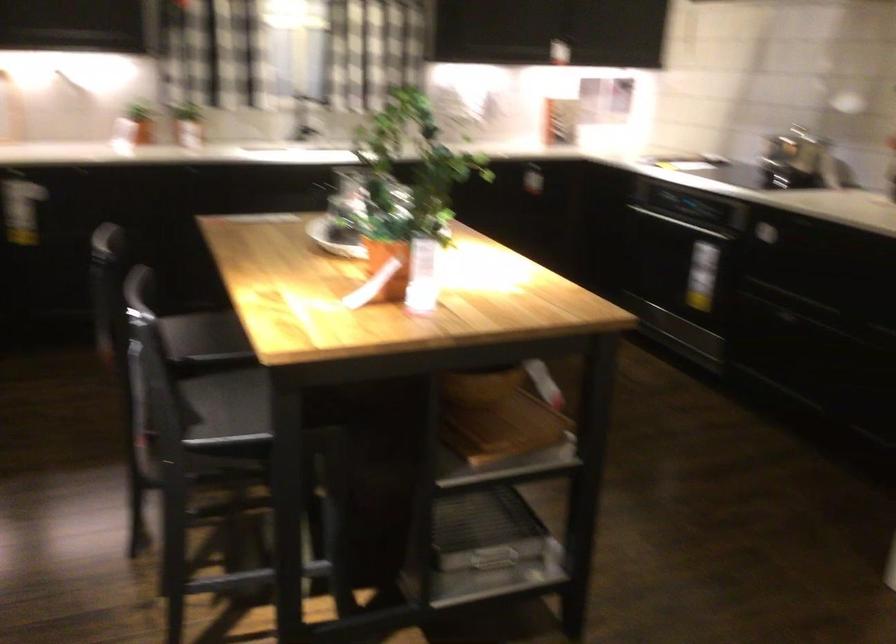
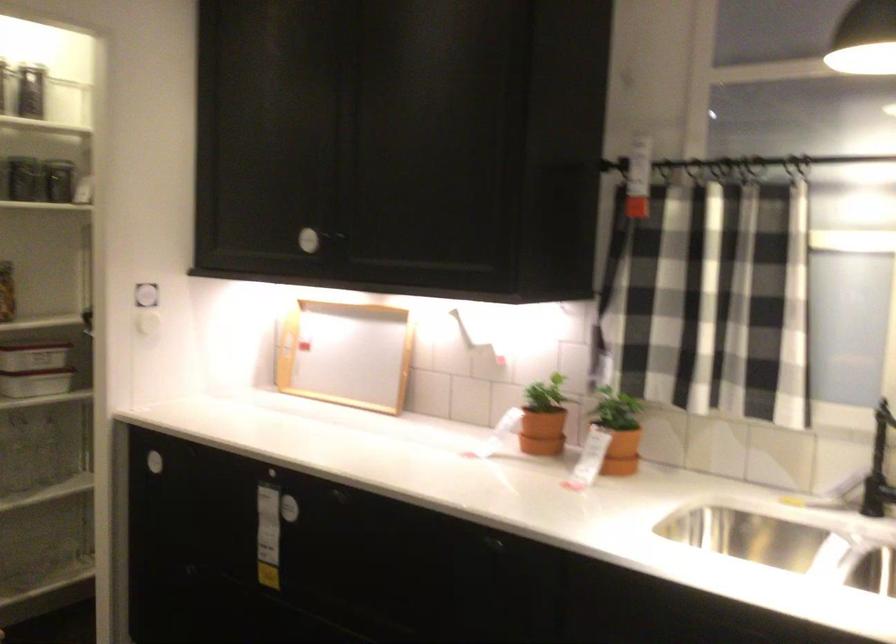
The point at (x=147, y=126) is marked in the first image. Where is the corresponding point in the second image?

(541, 431)